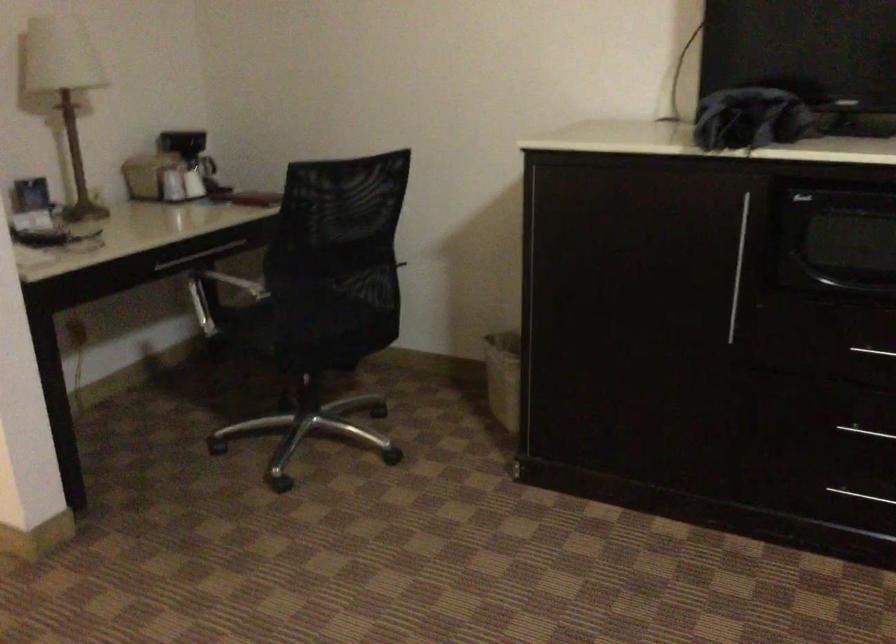
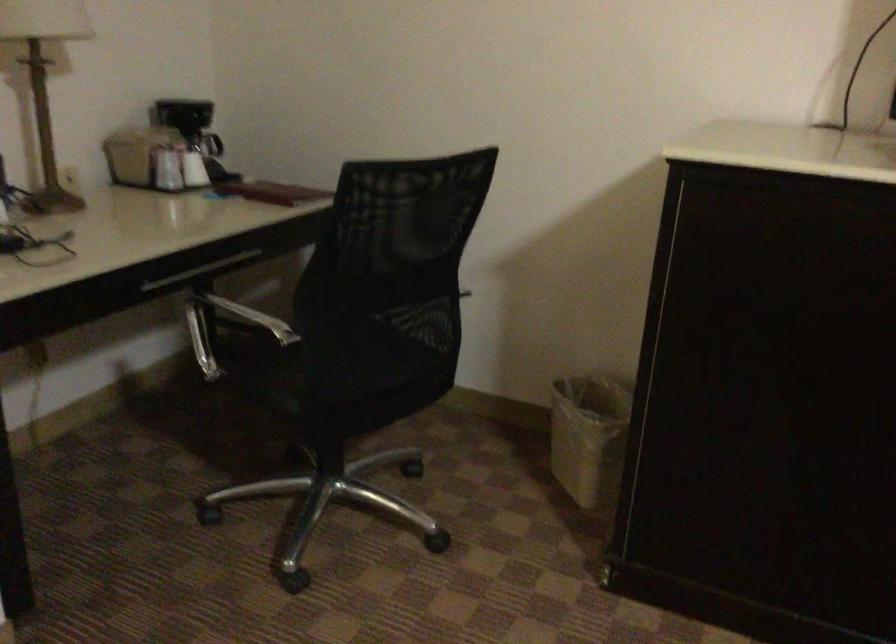
Where in the second image is the point corresponding to the point at 168,183 from the first image?

(165, 169)